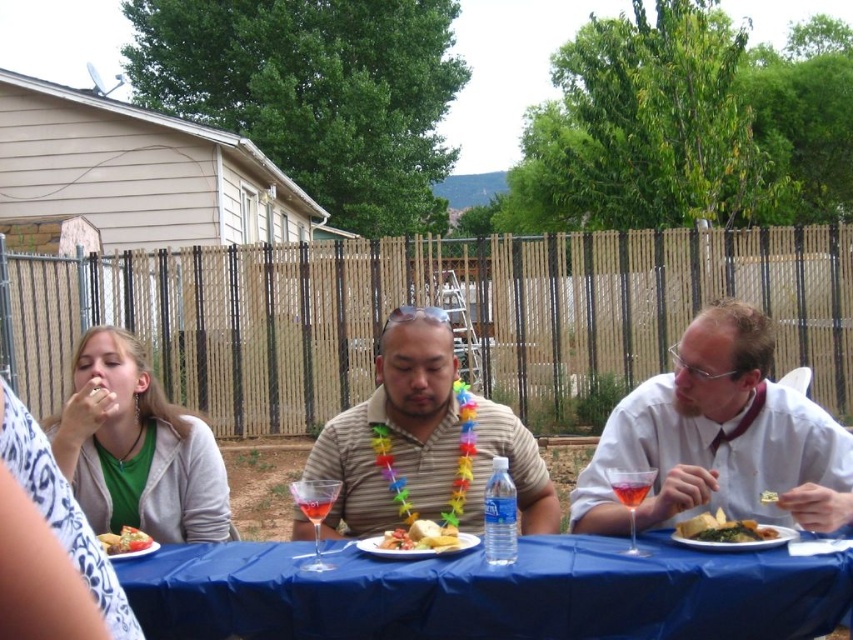
You are at a backyard gathering and see the matte green shirt at left and the translucent glass at center. Which object is closer to the left side of the image?

The matte green shirt at left is closer to the left side of the image because it is positioned to the left of the translucent glass at center.

What is located at the coordinates point (422, 536) in the image?

The point (422, 536) corresponds to the golden crispy bread at center.